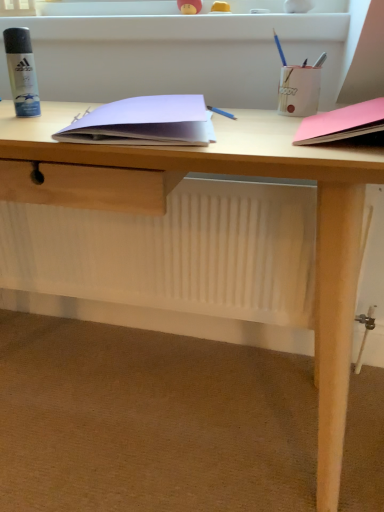
Question: From the image's perspective, is blue pencil at upper right, placed as the 3th stationery when sorted from right to left, over matte white pencil holder at upper right, the 3th stationery from the left?

Choices:
 (A) no
 (B) yes

Answer: (B)

Question: Is blue pencil at upper right, placed as the 3th stationery when sorted from right to left, not within matte white pencil holder at upper right, the 3th stationery from the left?

Choices:
 (A) no
 (B) yes

Answer: (B)

Question: Could matte white pencil holder at upper right, the 3th stationery from the left, be considered to be inside blue pencil at upper right, placed as the 3th stationery when sorted from right to left?

Choices:
 (A) yes
 (B) no

Answer: (B)

Question: Are blue pencil at upper right, placed as the 3th stationery when sorted from right to left, and matte white pencil holder at upper right, the 3th stationery from the left, far apart?

Choices:
 (A) yes
 (B) no

Answer: (B)

Question: Can you confirm if blue pencil at upper right, placed as the 3th stationery when sorted from right to left, is positioned to the left of matte white pencil holder at upper right, the 3th stationery from the left?

Choices:
 (A) no
 (B) yes

Answer: (B)

Question: Is blue pencil at upper right, the 2th stationery in the left-to-right sequence, situated inside pink matte paper at right, acting as the 1th paperback book starting from the right, or outside?

Choices:
 (A) outside
 (B) inside

Answer: (A)

Question: From a real-world perspective, is blue pencil at upper right, placed as the 3th stationery when sorted from right to left, above or below pink matte paper at right, the second paperback book when ordered from left to right?

Choices:
 (A) above
 (B) below

Answer: (A)

Question: In terms of size, does blue pencil at upper right, the 2th stationery in the left-to-right sequence, appear bigger or smaller than pink matte paper at right, the second paperback book when ordered from left to right?

Choices:
 (A) big
 (B) small

Answer: (B)

Question: Is point (276, 39) positioned closer to the camera than point (375, 128)?

Choices:
 (A) farther
 (B) closer

Answer: (A)

Question: Relative to white paper at center, the second paperback book from the right, is pink matte paper at right, acting as the 1th paperback book starting from the right, in front or behind?

Choices:
 (A) behind
 (B) front

Answer: (B)

Question: Is pink matte paper at right, acting as the 1th paperback book starting from the right, bigger or smaller than white paper at center, the second paperback book from the right?

Choices:
 (A) small
 (B) big

Answer: (A)

Question: Is pink matte paper at right, acting as the 1th paperback book starting from the right, inside or outside of white paper at center, arranged as the first paperback book when viewed from the left?

Choices:
 (A) inside
 (B) outside

Answer: (B)

Question: From the image's perspective, relative to white paper at center, the second paperback book from the right, is pink matte paper at right, acting as the 1th paperback book starting from the right, above or below?

Choices:
 (A) above
 (B) below

Answer: (B)

Question: In the image, is matte white pencil holder at upper right, the 3th stationery from the left, positioned in front of or behind pink matte paper at right, the second paperback book when ordered from left to right?

Choices:
 (A) front
 (B) behind

Answer: (B)

Question: Based on their sizes in the image, would you say matte white pencil holder at upper right, the 2th stationery in the right-to-left sequence, is bigger or smaller than pink matte paper at right, acting as the 1th paperback book starting from the right?

Choices:
 (A) big
 (B) small

Answer: (B)